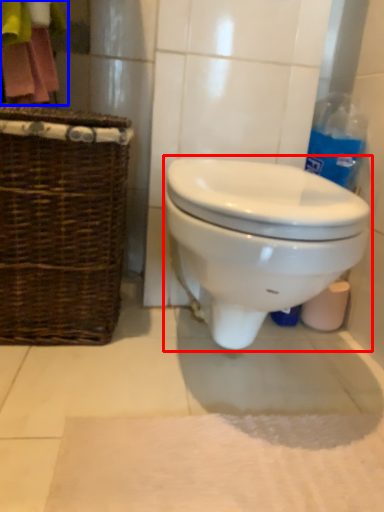
Question: Which object appears farthest to the camera in this image, toilet (highlighted by a red box) or laundry (highlighted by a blue box)?

Choices:
 (A) toilet
 (B) laundry

Answer: (B)